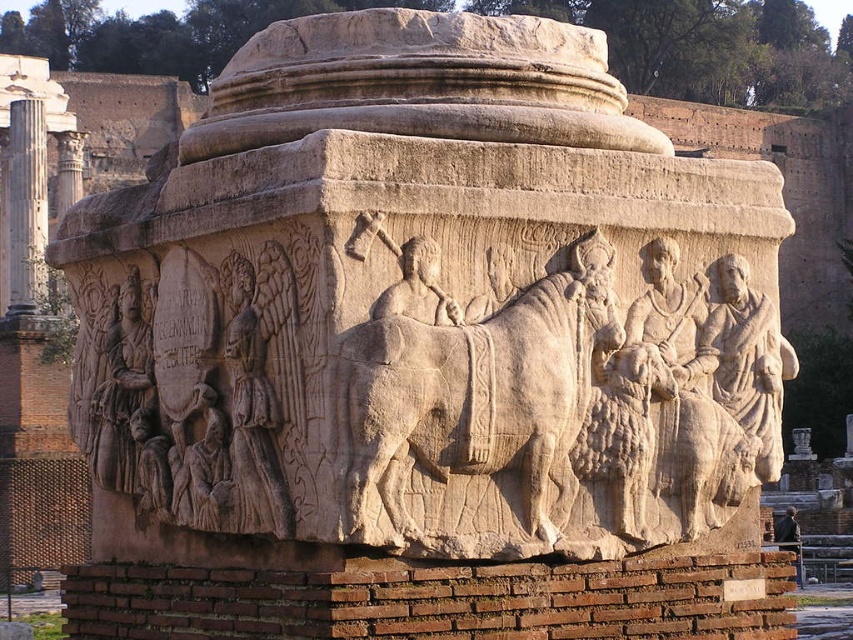
Looking at this image, you are an archaeologist examining the ancient stone monument. You notice the light beige stone figure at center and the smooth white column at left. Which object is closer to you from your current viewpoint?

The light beige stone figure at center is closer to you because it is positioned in front of the smooth white column at left.

You are an archaeologist examining the ancient stone monument. You notice the light beige stone figures at lower left. Where exactly are these figures located on the monument?

The light beige stone figures at lower left are located at the coordinates point (x=122, y=387).